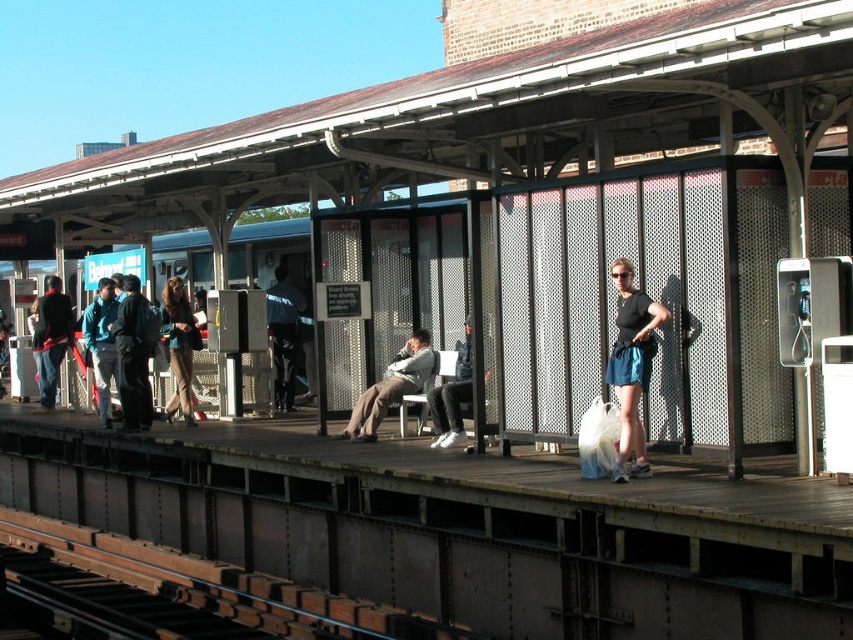
Question: Can you confirm if teal fabric jacket at center is thinner than matte black jacket at left?

Choices:
 (A) yes
 (B) no

Answer: (A)

Question: Is matte black tank top at right positioned in front of light brown leather jacket at center?

Choices:
 (A) yes
 (B) no

Answer: (A)

Question: Which object is farther from the camera taking this photo?

Choices:
 (A) light brown leather jacket at center
 (B) light gray fabric jacket at center
 (C) teal fabric jacket at center

Answer: (C)

Question: Considering the relative positions of matte black jacket at left and light gray fabric jacket at center in the image provided, where is matte black jacket at left located with respect to light gray fabric jacket at center?

Choices:
 (A) right
 (B) left

Answer: (B)

Question: Which of these objects is positioned farthest from the light brown leather jacket at center?

Choices:
 (A) matte black tank top at right
 (B) matte black jacket at left
 (C) light gray fabric jacket at center

Answer: (B)

Question: Estimate the real-world distances between objects in this image. Which object is farther from the matte black jacket at left?

Choices:
 (A) dark blue jeans at center
 (B) light brown leather jacket at center
 (C) matte black tank top at right
 (D) light gray fabric jacket at center

Answer: (C)